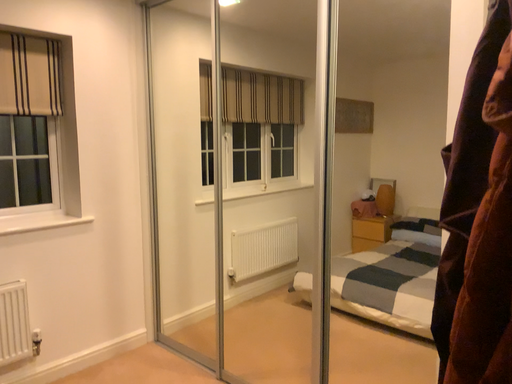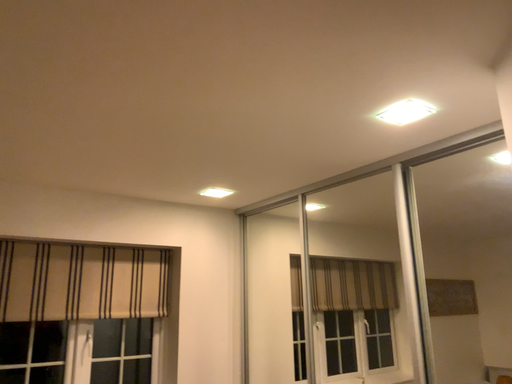
Question: Which way did the camera rotate in the video?

Choices:
 (A) rotated right
 (B) rotated left

Answer: (B)